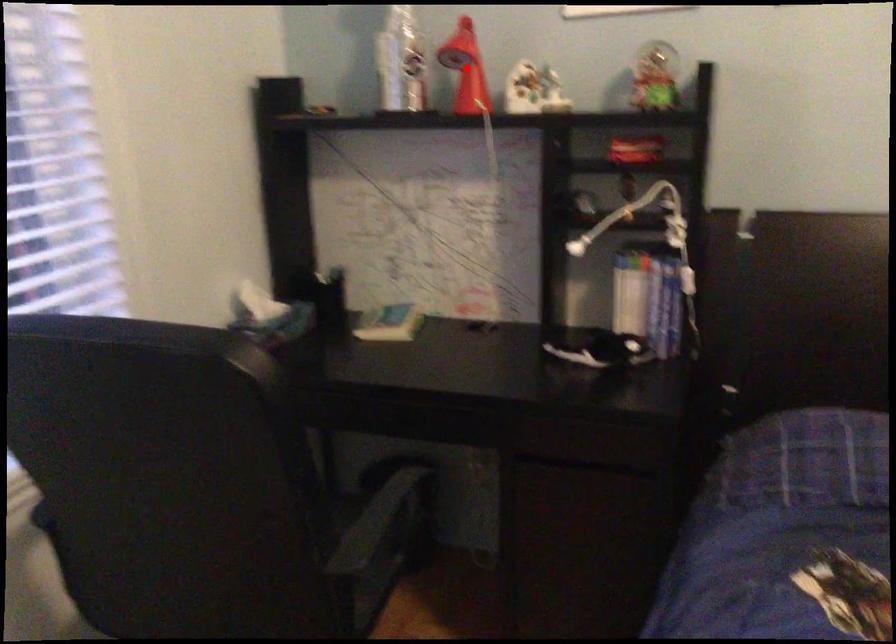
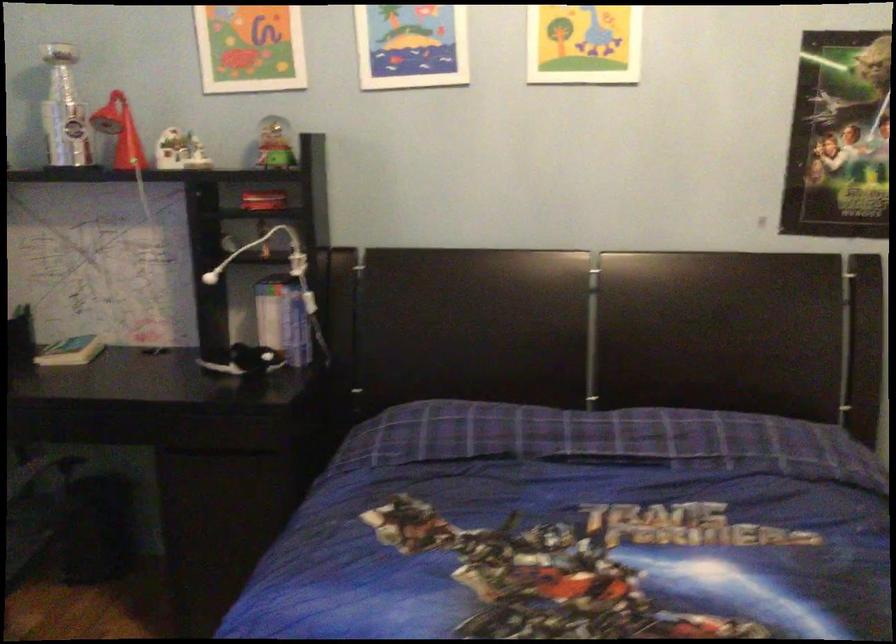
Question: I am providing you with two images of the same scene from different viewpoints. In image1, a red point is highlighted. Considering the same 3D point in image2, which of the following is correct?

Choices:
 (A) It is closer
 (B) It is farther

Answer: (B)